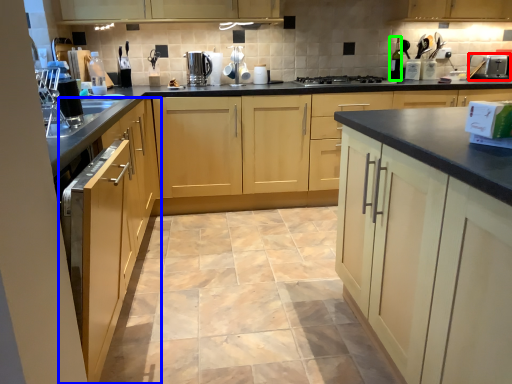
Question: Which object is positioned closest to kitchen appliance (highlighted by a red box)? Select from cabinetry (highlighted by a blue box) and bottle (highlighted by a green box).

Choices:
 (A) cabinetry
 (B) bottle

Answer: (B)